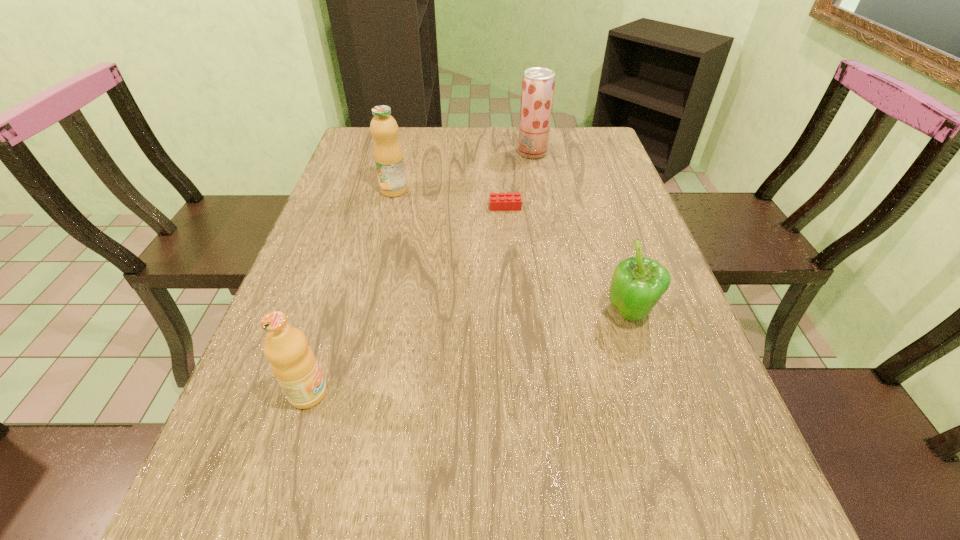
Where is `unoccupied area between the third farthest object and the shortest fruit juice`? The height and width of the screenshot is (540, 960). unoccupied area between the third farthest object and the shortest fruit juice is located at coordinates (407, 300).

Image resolution: width=960 pixels, height=540 pixels. What are the coordinates of `vacant space that is in between the fourth nearest object and the rightmost object` in the screenshot? It's located at (512, 252).

What are the coordinates of `vacant area that lies between the Lego and the fourth nearest object` in the screenshot? It's located at (449, 198).

Locate an element on the screen. free area in between the farthest object and the third object from right to left is located at coordinates [x=518, y=179].

Image resolution: width=960 pixels, height=540 pixels. Identify the location of vacant region between the second farthest object and the nearest fruit juice. (351, 292).

Locate an element on the screen. The width and height of the screenshot is (960, 540). free area in between the rightmost fruit juice and the fourth nearest object is located at coordinates (463, 172).

Locate an element on the screen. The height and width of the screenshot is (540, 960). free space that is in between the second farthest fruit juice and the rightmost object is located at coordinates (512, 252).

This screenshot has width=960, height=540. What are the coordinates of `empty space that is in between the shortest object and the nearest object` in the screenshot? It's located at (407, 300).

This screenshot has height=540, width=960. Find the location of `empty location between the second farthest fruit juice and the rightmost object`. empty location between the second farthest fruit juice and the rightmost object is located at coordinates (512, 252).

Where is `free space between the shortest fruit juice and the third farthest object`? Image resolution: width=960 pixels, height=540 pixels. free space between the shortest fruit juice and the third farthest object is located at coordinates (407, 300).